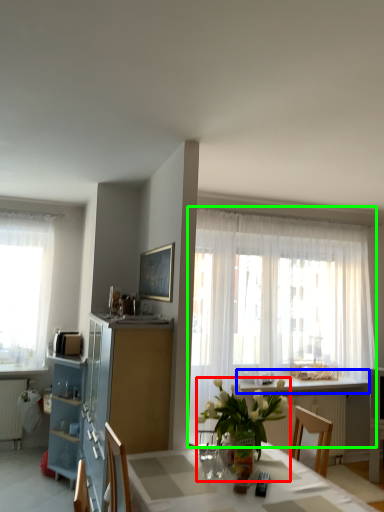
Question: Which object is positioned farthest from houseplant (highlighted by a red box)? Select from counter top (highlighted by a blue box) and curtain (highlighted by a green box).

Choices:
 (A) counter top
 (B) curtain

Answer: (B)